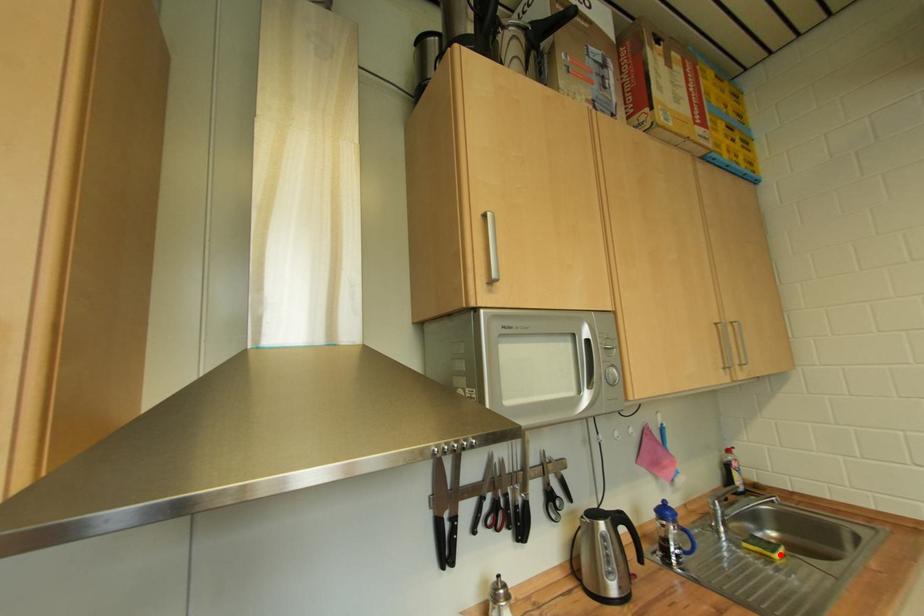
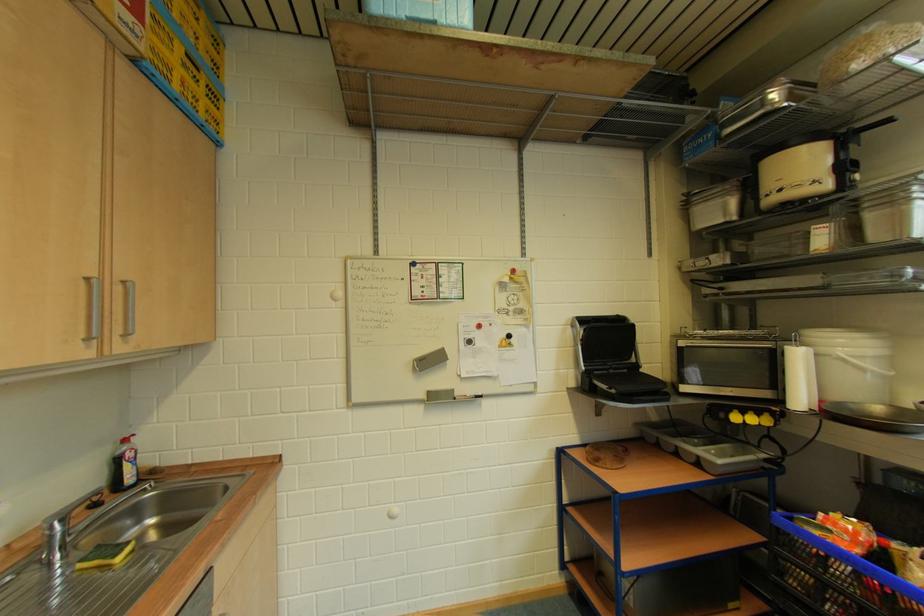
In the second image, find the point that corresponds to the highlighted location in the first image.

(124, 559)